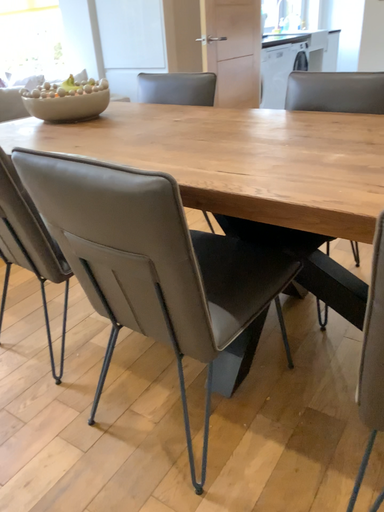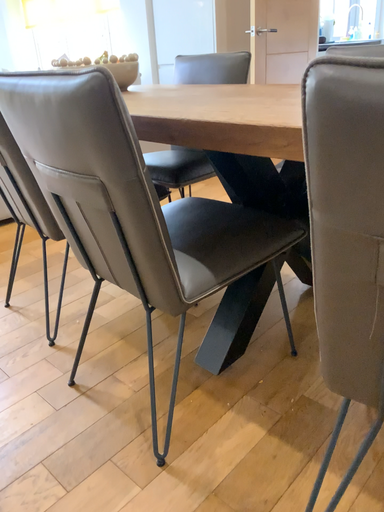
Question: How did the camera likely rotate when shooting the video?

Choices:
 (A) rotated right
 (B) rotated left

Answer: (B)